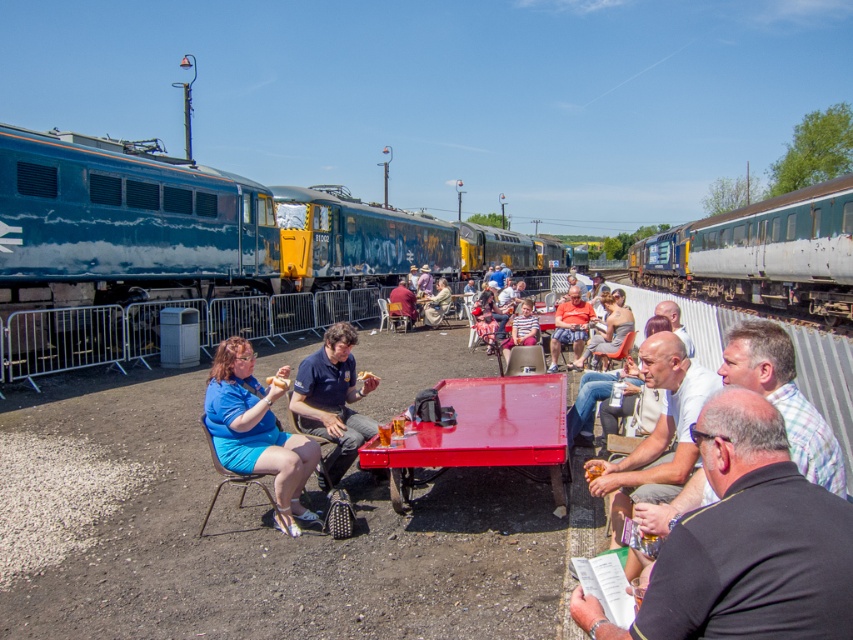
Question: Does blue uniform at center have a greater width compared to orange fabric shorts at center?

Choices:
 (A) no
 (B) yes

Answer: (A)

Question: Estimate the real-world distances between objects in this image. Which object is farther from the blue fabric shorts at lower left?

Choices:
 (A) light brown leather jacket at center
 (B) shiny red table at center
 (C) matte black jacket at center
 (D) dark gray shirt at center

Answer: (C)

Question: Which object is positioned closest to the blue uniform at center?

Choices:
 (A) denim shorts at center
 (B) matte black jacket at center
 (C) matte red shirt at center
 (D) green metallic passenger train at center

Answer: (A)

Question: Can you confirm if dark gray shirt at center is positioned above denim shorts at center?

Choices:
 (A) yes
 (B) no

Answer: (B)

Question: Is dark gray shirt at center closer to camera compared to green metallic passenger train at center?

Choices:
 (A) yes
 (B) no

Answer: (A)

Question: Which of the following is the farthest from the observer?

Choices:
 (A) dark gray shirt at center
 (B) light brown leather jacket at center
 (C) shiny red table at center
 (D) blue fabric shorts at lower left

Answer: (D)